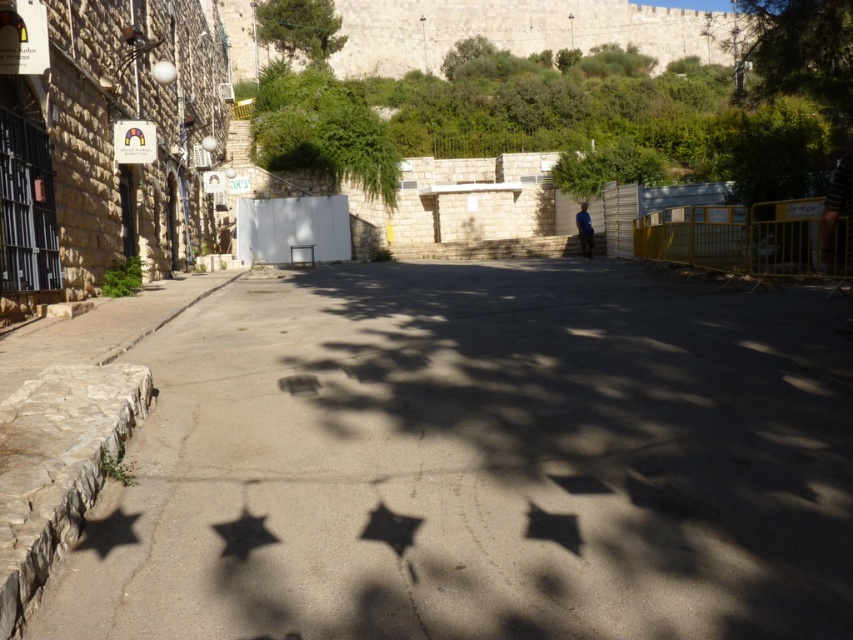
Is point (86, 545) in front of point (405, 518)?

That is True.

Can you confirm if metallic star at lower left is positioned below metallic star at center?

Incorrect, metallic star at lower left is not positioned below metallic star at center.

Between point (111, 529) and point (376, 538), which one is positioned behind?

Point (111, 529)

The width and height of the screenshot is (853, 640). What are the coordinates of `metallic star at lower left` in the screenshot? It's located at (108, 531).

Measure the distance between point [85,545] and camera.

A distance of 3.84 meters exists between point [85,545] and camera.

Between metallic star at lower left and black matte star at lower center, which one has less height?

metallic star at lower left is shorter.

The height and width of the screenshot is (640, 853). What do you see at coordinates (108, 531) in the screenshot? I see `metallic star at lower left` at bounding box center [108, 531].

The height and width of the screenshot is (640, 853). What are the coordinates of `metallic star at lower left` in the screenshot? It's located at (108, 531).

What do you see at coordinates (485, 460) in the screenshot?
I see `gray concrete pavement at center` at bounding box center [485, 460].

From the picture: Between gray concrete pavement at center and metallic silver star at center, which one has less height?

Standing shorter between the two is metallic silver star at center.

Where is `gray concrete pavement at center`? gray concrete pavement at center is located at coordinates (485, 460).